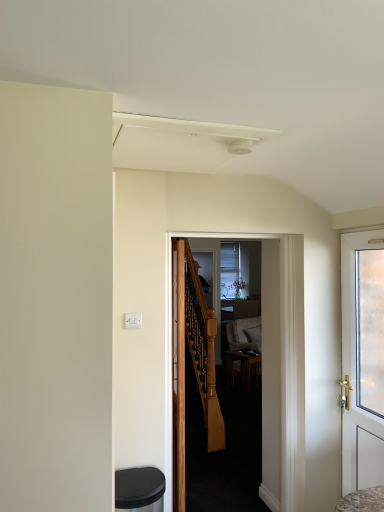
Question: Considering their positions, is wooden door at center, which appears as the 2th door when viewed from the left, located in front of or behind black plastic music stool at lower left?

Choices:
 (A) behind
 (B) front

Answer: (A)

Question: Looking at their shapes, would you say wooden door at center, marked as the 2th door in a right-to-left arrangement, is wider or thinner than black plastic music stool at lower left?

Choices:
 (A) thin
 (B) wide

Answer: (A)

Question: Estimate the real-world distances between objects in this image. Which object is closer to the brown wooden table at center?

Choices:
 (A) white glossy door at right, which is the first door from right to left
 (B) wooden door at center, the third door viewed from the right
 (C) black plastic music stool at lower left
 (D) wooden door at center, marked as the 2th door in a right-to-left arrangement

Answer: (D)

Question: Estimate the real-world distances between objects in this image. Which object is farther from the black plastic music stool at lower left?

Choices:
 (A) wooden door at center, which appears as the 2th door when viewed from the left
 (B) brown wooden table at center
 (C) wooden door at center, which ranks as the 1th door in left-to-right order
 (D) white glossy door at right, which ranks as the 3th door in left-to-right order

Answer: (B)